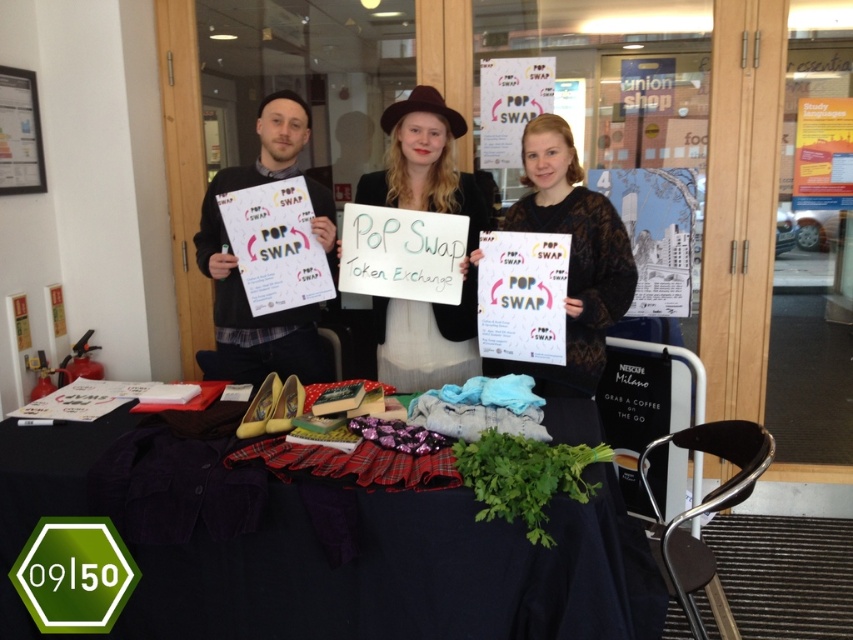
Does velvet fabric table at center come in front of matte black hat at center?

Yes.

Locate an element on the screen. This screenshot has height=640, width=853. velvet fabric table at center is located at coordinates (323, 552).

Who is positioned more to the left, matte black hat at center or matte black poster at center?

From the viewer's perspective, matte black poster at center appears more on the left side.

What do you see at coordinates (428, 211) in the screenshot? I see `matte black hat at center` at bounding box center [428, 211].

I want to click on matte black hat at center, so click(x=428, y=211).

Does matte black hat at center appear under matte black sweater at center?

Actually, matte black hat at center is above matte black sweater at center.

Which is more to the right, matte black hat at center or matte black sweater at center?

From the viewer's perspective, matte black sweater at center appears more on the right side.

Who is more distant from viewer, (444, 307) or (515, 211)?

The point (515, 211) is behind.

You are a GUI agent. You are given a task and a screenshot of the screen. Output one action in this format:
    pyautogui.click(x=<x>, y=<y>)
    Task: Click on the matte black hat at center
    Image resolution: width=853 pixels, height=640 pixels.
    Given the screenshot: What is the action you would take?
    pyautogui.click(x=428, y=211)